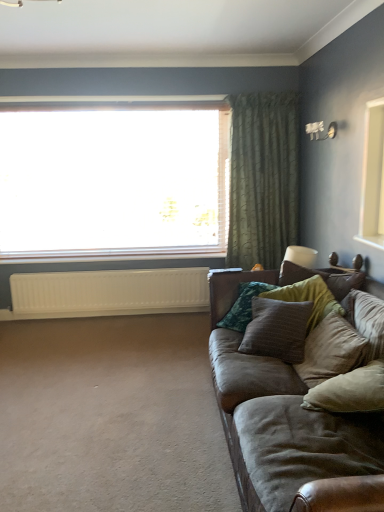
Question: Does textured brown pillow at right, arranged as the 1th pillow when viewed from the back, lie behind transparent glass window at upper center?

Choices:
 (A) no
 (B) yes

Answer: (A)

Question: Does textured brown pillow at right, which is counted as the 3th pillow, starting from the front, have a lesser height compared to transparent glass window at upper center?

Choices:
 (A) yes
 (B) no

Answer: (A)

Question: From the image's perspective, is textured brown pillow at right, which is counted as the 3th pillow, starting from the front, above transparent glass window at upper center?

Choices:
 (A) no
 (B) yes

Answer: (A)

Question: From the image's perspective, does textured brown pillow at right, arranged as the 1th pillow when viewed from the back, appear lower than transparent glass window at upper center?

Choices:
 (A) yes
 (B) no

Answer: (A)

Question: Could you tell me if textured brown pillow at right, which is counted as the 3th pillow, starting from the front, is facing transparent glass window at upper center?

Choices:
 (A) no
 (B) yes

Answer: (A)

Question: Is textured brown pillow at right, arranged as the 1th pillow when viewed from the back, smaller than transparent glass window at upper center?

Choices:
 (A) yes
 (B) no

Answer: (A)

Question: Can you confirm if green textured curtain at upper right is positioned to the right of white matte radiator at lower left?

Choices:
 (A) no
 (B) yes

Answer: (B)

Question: Is green textured curtain at upper right in contact with white matte radiator at lower left?

Choices:
 (A) no
 (B) yes

Answer: (A)

Question: Is green textured curtain at upper right bigger than white matte radiator at lower left?

Choices:
 (A) yes
 (B) no

Answer: (A)

Question: Is green textured curtain at upper right oriented towards white matte radiator at lower left?

Choices:
 (A) yes
 (B) no

Answer: (B)

Question: Does green textured curtain at upper right have a smaller size compared to white matte radiator at lower left?

Choices:
 (A) no
 (B) yes

Answer: (A)

Question: Is green textured curtain at upper right turned away from white matte radiator at lower left?

Choices:
 (A) yes
 (B) no

Answer: (B)

Question: Is transparent glass window at upper center closer to the viewer compared to green textured curtain at upper right?

Choices:
 (A) no
 (B) yes

Answer: (A)